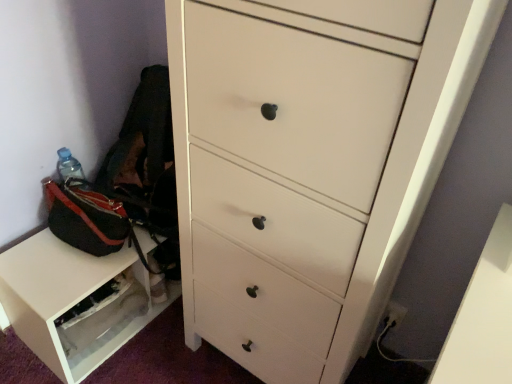
Question: Would you say white matte chest of drawers at center is outside transparent plastic drawer at lower left?

Choices:
 (A) no
 (B) yes

Answer: (B)

Question: Does white matte chest of drawers at center have a lesser width compared to transparent plastic drawer at lower left?

Choices:
 (A) yes
 (B) no

Answer: (B)

Question: Are white matte chest of drawers at center and transparent plastic drawer at lower left far apart?

Choices:
 (A) yes
 (B) no

Answer: (B)

Question: Is white matte chest of drawers at center facing towards transparent plastic drawer at lower left?

Choices:
 (A) yes
 (B) no

Answer: (B)

Question: Is white matte chest of drawers at center looking in the opposite direction of transparent plastic drawer at lower left?

Choices:
 (A) no
 (B) yes

Answer: (A)

Question: From a real-world perspective, is white matte chest of drawers at center beneath transparent plastic drawer at lower left?

Choices:
 (A) no
 (B) yes

Answer: (A)

Question: Is transparent plastic drawer at lower left facing away from white matte chest of drawers at center?

Choices:
 (A) no
 (B) yes

Answer: (A)

Question: Is transparent plastic drawer at lower left directly adjacent to white matte chest of drawers at center?

Choices:
 (A) no
 (B) yes

Answer: (A)

Question: Can you confirm if transparent plastic drawer at lower left is positioned to the right of white matte chest of drawers at center?

Choices:
 (A) yes
 (B) no

Answer: (B)

Question: Considering the relative sizes of transparent plastic drawer at lower left and white matte chest of drawers at center in the image provided, is transparent plastic drawer at lower left shorter than white matte chest of drawers at center?

Choices:
 (A) no
 (B) yes

Answer: (B)

Question: Is transparent plastic drawer at lower left at the left side of white matte chest of drawers at center?

Choices:
 (A) no
 (B) yes

Answer: (B)

Question: From the image's perspective, does transparent plastic drawer at lower left appear higher than white matte chest of drawers at center?

Choices:
 (A) no
 (B) yes

Answer: (A)

Question: From a real-world perspective, is white matte chest of drawers at center above or below transparent plastic drawer at lower left?

Choices:
 (A) below
 (B) above

Answer: (B)